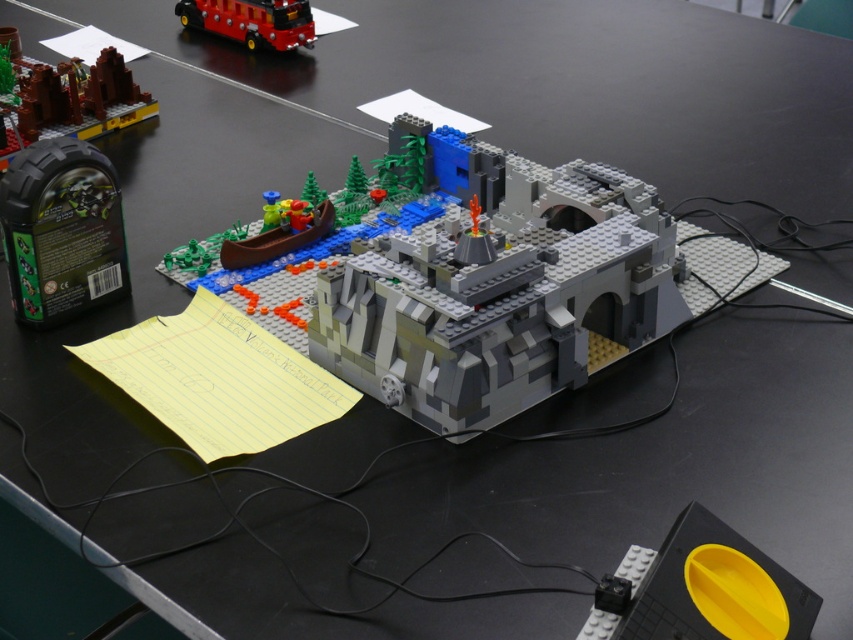
Question: From the image, what is the correct spatial relationship of gray matte volcano at center in relation to brick red lego set at upper left?

Choices:
 (A) above
 (B) below

Answer: (B)

Question: Among these points, which one is farthest from the camera?

Choices:
 (A) (419, 237)
 (B) (30, 99)

Answer: (B)

Question: Among these objects, which one is nearest to the camera?

Choices:
 (A) brick red lego set at upper left
 (B) gray matte volcano at center
 (C) shiny red bus at upper left
 (D) yellow matte plate at lower right

Answer: (D)

Question: Is gray matte volcano at center above brick red lego set at upper left?

Choices:
 (A) yes
 (B) no

Answer: (B)

Question: Is yellow matte plate at lower right above shiny red bus at upper left?

Choices:
 (A) no
 (B) yes

Answer: (A)

Question: Which object appears closest to the camera in this image?

Choices:
 (A) shiny red bus at upper left
 (B) yellow matte plate at lower right

Answer: (B)